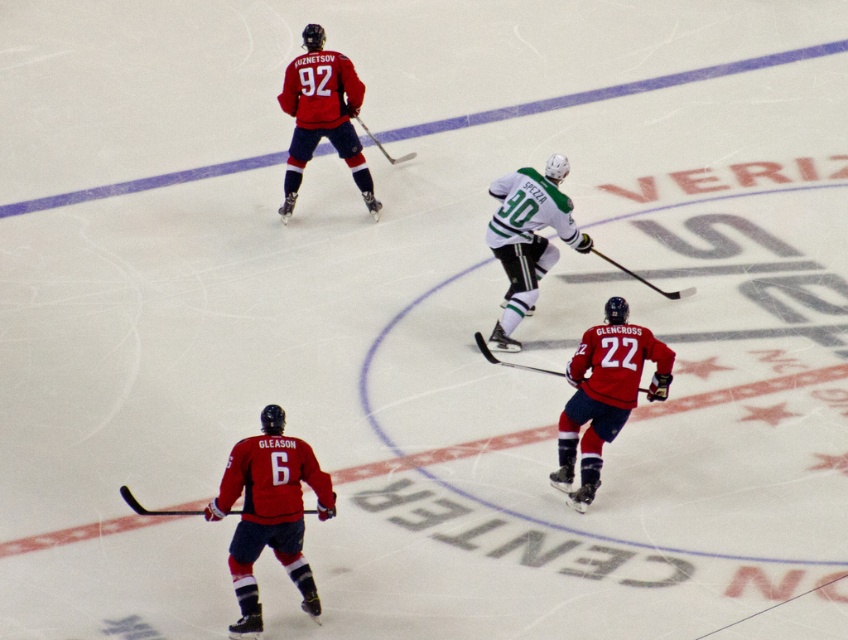
You are a hockey player trying to intercept the puck during a game. You see two points marked on the ice. The first point is at coordinate point(248, 566) and the second point is at coordinate point(350, 116). Which point is closer to you if you are facing the direction of play?

Point(248, 566) is in front of point(350, 116), so it is closer to you when facing the direction of play.

You are a hockey player trying to choose a stick for a quick shot. You need a stick that is longer to get more power. Which hockey stick should you choose between the matte black hockey stick at lower center and the black glossy hockey stick at center?

The black glossy hockey stick at center is longer than the matte black hockey stick at lower center, so you should choose the black glossy hockey stick at center for a more powerful shot.

You are a hockey player trying to reach the puck. You see a point at coordinates (x=154, y=509) on the ice. Is this point located on the matte black hockey stick at lower center?

Yes, the point at coordinates (x=154, y=509) is located on the matte black hockey stick at lower center.